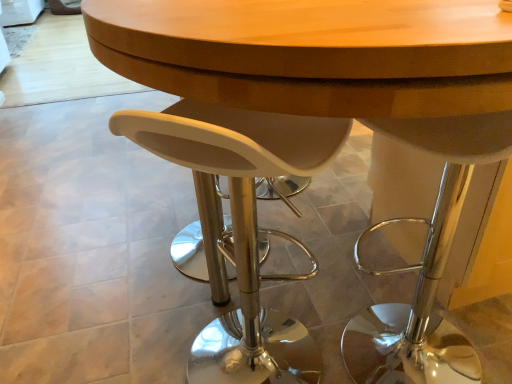
Describe the element at coordinates (241, 226) in the screenshot. This screenshot has height=384, width=512. I see `white plastic stool at center` at that location.

What are the coordinates of `white plastic stool at center` in the screenshot? It's located at (241, 226).

Identify the location of white plastic stool at center. This screenshot has width=512, height=384. (241, 226).